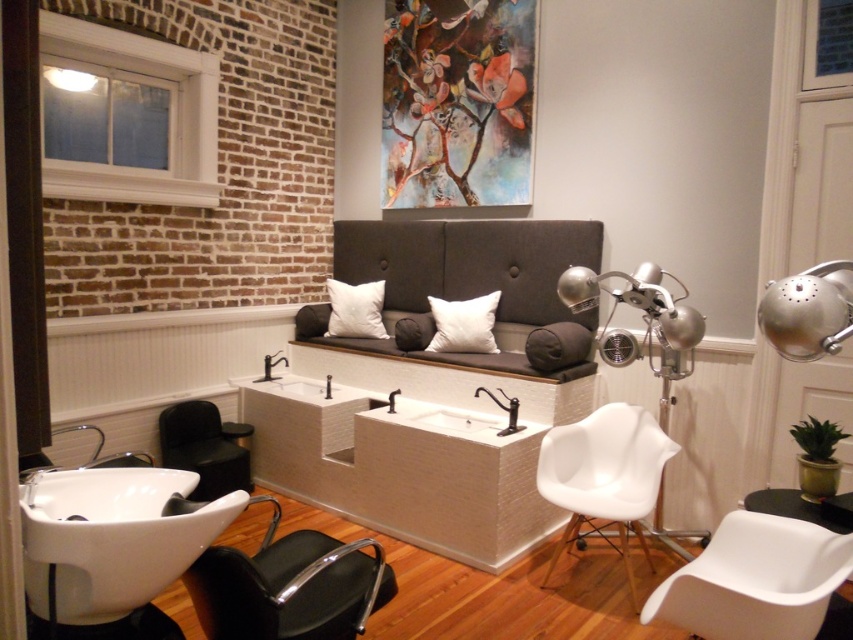
Question: From the image, what is the correct spatial relationship of metallic silver lamp at upper right in relation to black leather armchair at lower left?

Choices:
 (A) left
 (B) right

Answer: (B)

Question: Among these points, which one is nearest to the camera?

Choices:
 (A) (361, 336)
 (B) (461, 301)

Answer: (B)

Question: Based on their relative distances, which object is nearer to the white glossy sink at lower left?

Choices:
 (A) white plastic swivel chair at lower right
 (B) white soft cushion at center
 (C) dark gray fabric couch at center

Answer: (A)

Question: Is dark gray fabric couch at center to the right of metallic silver lamp at upper right from the viewer's perspective?

Choices:
 (A) no
 (B) yes

Answer: (A)

Question: Which point is farther to the camera?

Choices:
 (A) white matte pillow at center
 (B) white plastic swivel chair at lower right
 (C) white plastic chair at center
 (D) white glossy sink at lower left

Answer: (A)

Question: Observing the image, what is the correct spatial positioning of white plastic swivel chair at lower right in reference to metallic silver lamp at upper right?

Choices:
 (A) below
 (B) above

Answer: (A)